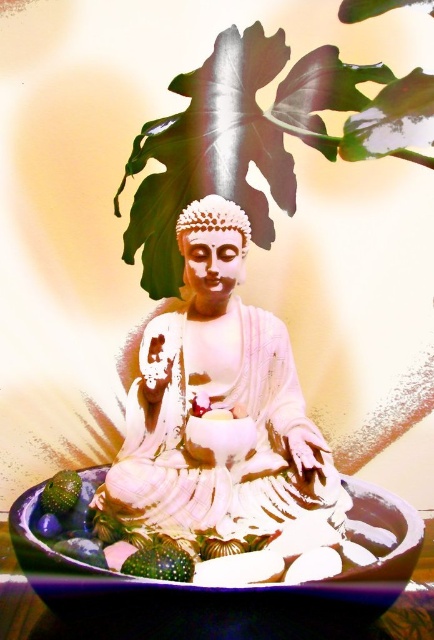
Question: Can you confirm if green leafy plant at upper center is positioned above green matte/soft fruit at lower center?

Choices:
 (A) no
 (B) yes

Answer: (B)

Question: Does white glossy statue at center have a smaller size compared to green matte/soft fruit at lower center?

Choices:
 (A) no
 (B) yes

Answer: (A)

Question: From the image, what is the correct spatial relationship of white glossy statue at center in relation to green leafy plant at upper center?

Choices:
 (A) above
 (B) below

Answer: (B)

Question: Estimate the real-world distances between objects in this image. Which object is closer to the green leafy plant at upper center?

Choices:
 (A) matte ceramic bowl at center
 (B) white glossy statue at center

Answer: (B)

Question: Which object is positioned closest to the green leafy plant at upper center?

Choices:
 (A) matte ceramic bowl at center
 (B) white glossy statue at center

Answer: (B)

Question: Considering the real-world distances, which object is closest to the matte ceramic bowl at center?

Choices:
 (A) green matte avocado at lower left
 (B) white glossy statue at center
 (C) green matte/soft fruit at lower center

Answer: (C)